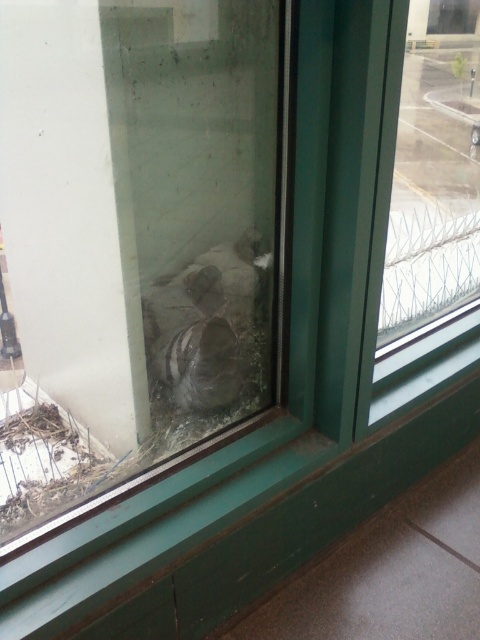
Question: Is transparent glass door at center further to camera compared to transparent glass window at center?

Choices:
 (A) yes
 (B) no

Answer: (B)

Question: Does transparent glass door at center lie in front of transparent glass window at center?

Choices:
 (A) yes
 (B) no

Answer: (A)

Question: Which point is farther to the camera?

Choices:
 (A) transparent glass door at center
 (B) transparent glass window at center

Answer: (B)

Question: Which object is positioned farthest from the shiny metallic bird at center?

Choices:
 (A) transparent glass window at center
 (B) transparent glass door at center

Answer: (A)

Question: In this image, where is transparent glass window at center located relative to shiny metallic bird at center?

Choices:
 (A) below
 (B) above

Answer: (B)

Question: Which of the following is the closest to the observer?

Choices:
 (A) transparent glass door at center
 (B) shiny metallic bird at center
 (C) transparent glass window at center

Answer: (A)